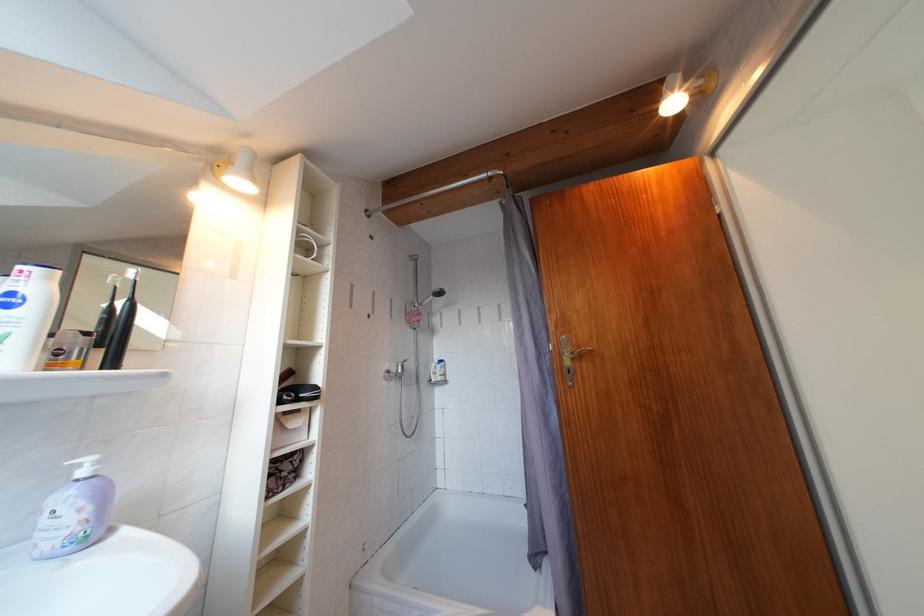
This screenshot has width=924, height=616. Find the location of `white shower bottle`. white shower bottle is located at coordinates (26, 314).